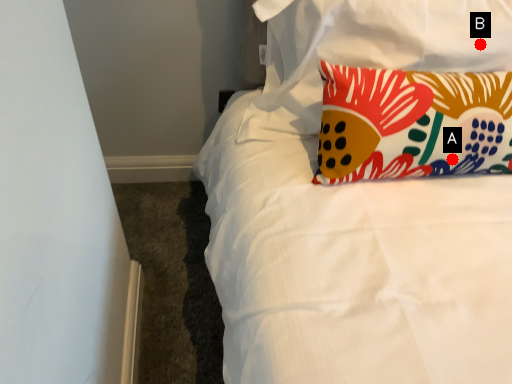
Question: Two points are circled on the image, labeled by A and B beside each circle. Which point is farther from the camera taking this photo?

Choices:
 (A) A is further
 (B) B is further

Answer: (B)